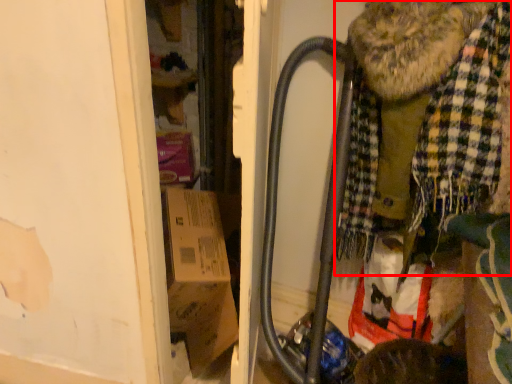
Question: From the image's perspective, where is scarf (annotated by the red box) located relative to baby carriage?

Choices:
 (A) above
 (B) below

Answer: (B)